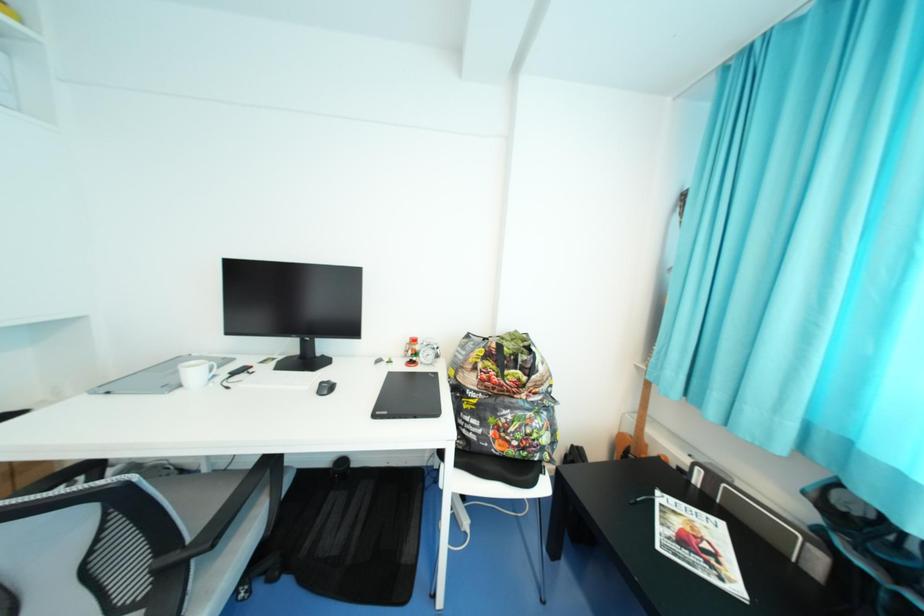
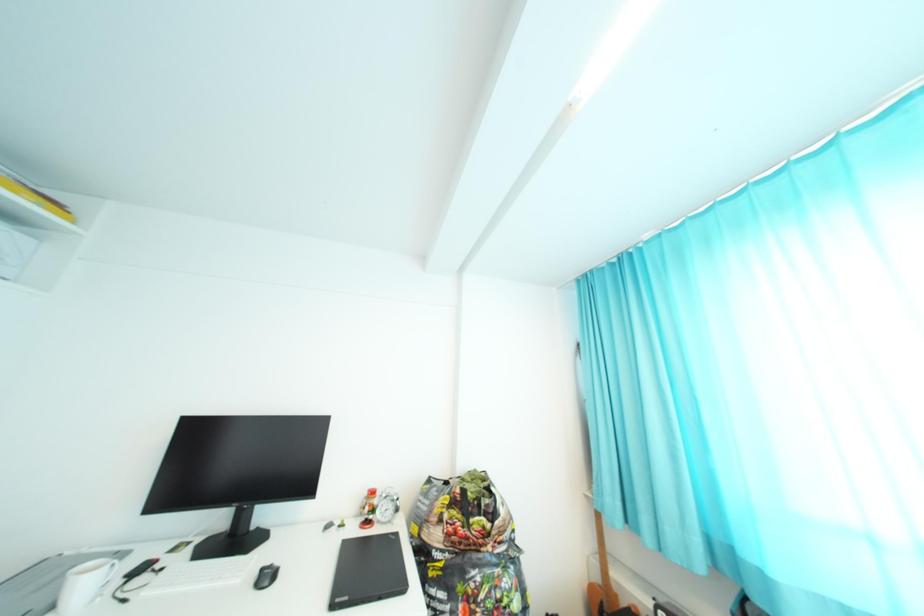
Question: What movement of the cameraman would produce the second image?

Choices:
 (A) Left
 (B) Right
 (C) Forward
 (D) Backward

Answer: (D)